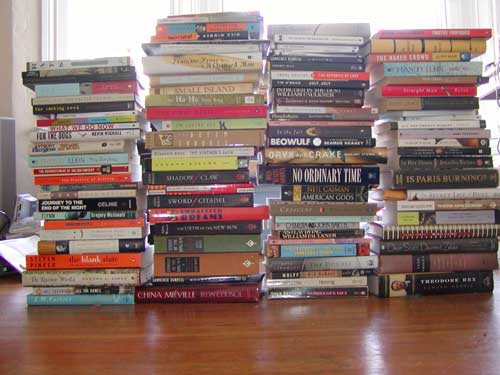
Locate an element on the screen. This screenshot has width=500, height=375. wood table is located at coordinates (325, 364).